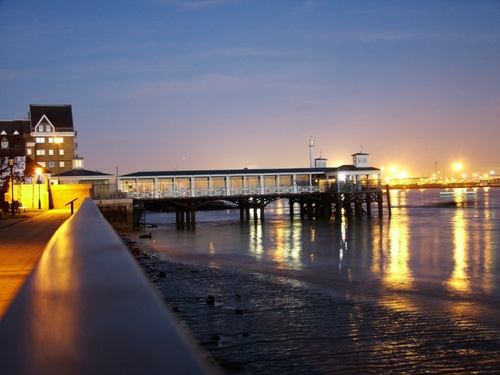
Find the location of a particular element. The height and width of the screenshot is (375, 500). yellow lights is located at coordinates (45, 196), (34, 191), (30, 194).